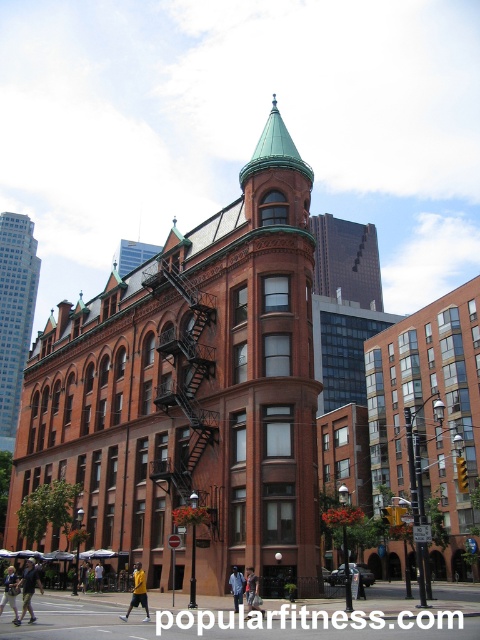
Who is lower down, light blue denim jacket at lower left or light blue jeans at center?

light blue denim jacket at lower left is below.

Is light blue denim jacket at lower left to the right of light blue jeans at center from the viewer's perspective?

No, light blue denim jacket at lower left is not to the right of light blue jeans at center.

The image size is (480, 640). Identify the location of light blue denim jacket at lower left. (10, 592).

Does light blue denim jacket at lower left have a lesser width compared to dark blue jeans at center?

No.

Which is below, light blue denim jacket at lower left or dark blue jeans at center?

Positioned lower is light blue denim jacket at lower left.

Does point (13, 576) come in front of point (240, 598)?

No, it is not.

What are the coordinates of `light blue denim jacket at lower left` in the screenshot? It's located at (10, 592).

Based on the photo, can you confirm if dark blue jeans at lower left is smaller than dark blue jeans at center?

Actually, dark blue jeans at lower left might be larger than dark blue jeans at center.

Does dark blue jeans at lower left have a greater height compared to dark blue jeans at center?

Correct, dark blue jeans at lower left is much taller as dark blue jeans at center.

Is point (28, 584) in front of point (230, 580)?

Yes, it is in front of point (230, 580).

The width and height of the screenshot is (480, 640). Identify the location of dark blue jeans at lower left. (28, 589).